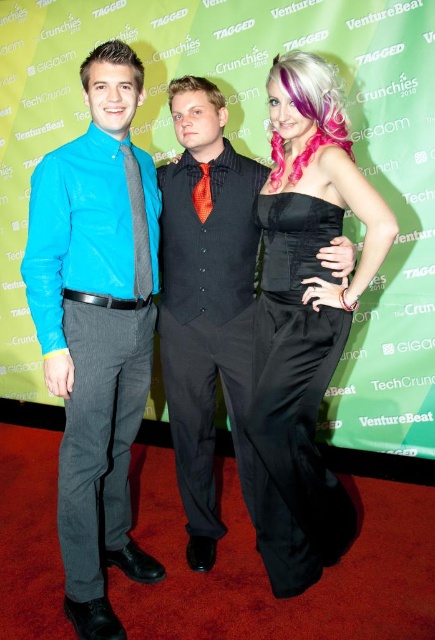
You are a photographer at the event and want to focus your camera on the shiny black vest at center. According to the coordinates, where should you aim your camera?

You should aim your camera at the coordinates point (x=206, y=300) where the shiny black vest at center is located.

You are a photographer at the event and need to adjust the lighting so that both the matte blue shirt at left and the black satin dress at center are equally visible. Given their positions, which one might require more adjustment? Explain why based on their placement.

The matte blue shirt at left is located above the black satin dress at center. Since it is higher up, it might receive more direct light, potentially making it brighter. The black satin dress at center, being lower, could be in a slightly shadowed area. Therefore, the matte blue shirt at left might need more adjustment to reduce its brightness, while the black satin dress at center might need exposure compensation to ensure details are captured properly.